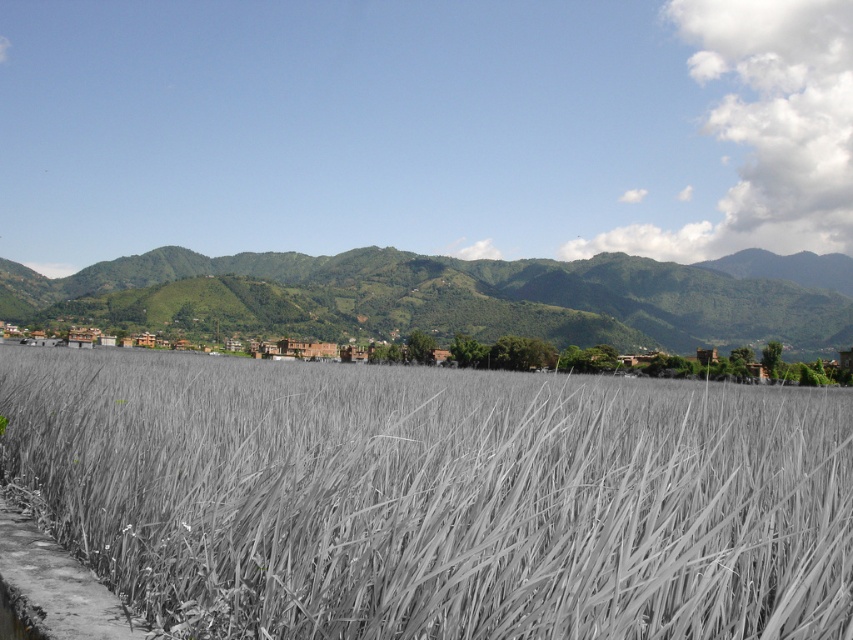
Which is behind, point (485, 442) or point (325, 285)?

The point (325, 285) is more distant.

Can you confirm if gray matte rice field at center is positioned to the right of green leafy mountain at center?

A: Indeed, gray matte rice field at center is positioned on the right side of green leafy mountain at center.

Between point (668, 540) and point (778, 307), which one is positioned in front?

Positioned in front is point (668, 540).

Image resolution: width=853 pixels, height=640 pixels. What are the coordinates of `gray matte rice field at center` in the screenshot? It's located at (436, 497).